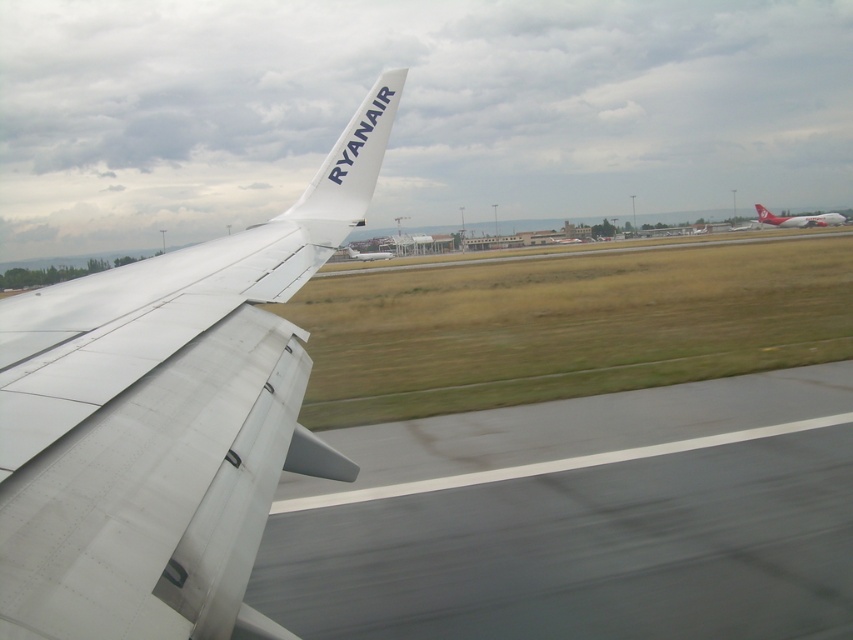
Question: Is gray asphalt runway at lower center to the right of white matte airplane wing at left from the viewer's perspective?

Choices:
 (A) yes
 (B) no

Answer: (A)

Question: Which object appears farthest from the camera in this image?

Choices:
 (A) gray asphalt runway at lower center
 (B) white matte airplane at center
 (C) white glossy airplane at right

Answer: (C)

Question: Which point is farther from the camera taking this photo?

Choices:
 (A) (369, 257)
 (B) (759, 218)
 (C) (224, 438)
 (D) (769, 403)

Answer: (B)

Question: Considering the real-world distances, which object is farthest from the white matte airplane wing at left?

Choices:
 (A) gray asphalt runway at lower center
 (B) white glossy airplane at right

Answer: (B)

Question: Is white matte airplane wing at left below white matte ryanair tail at upper center?

Choices:
 (A) yes
 (B) no

Answer: (A)

Question: Does white matte airplane wing at left appear on the right side of white glossy airplane at right?

Choices:
 (A) yes
 (B) no

Answer: (B)